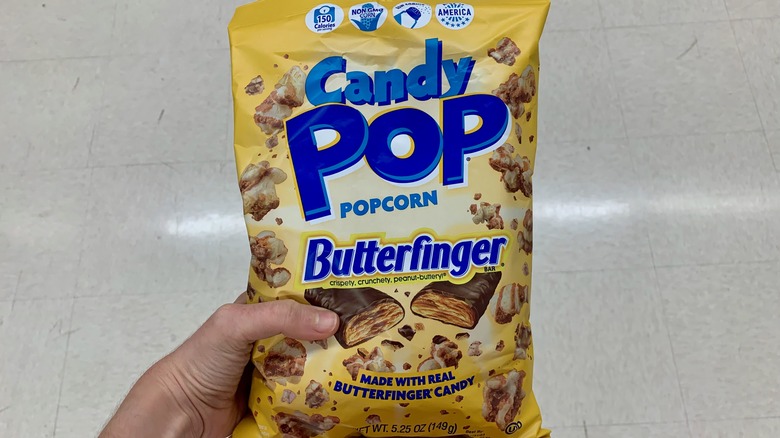
Image resolution: width=780 pixels, height=438 pixels. Find the location of `tile`. tile is located at coordinates (594, 319).